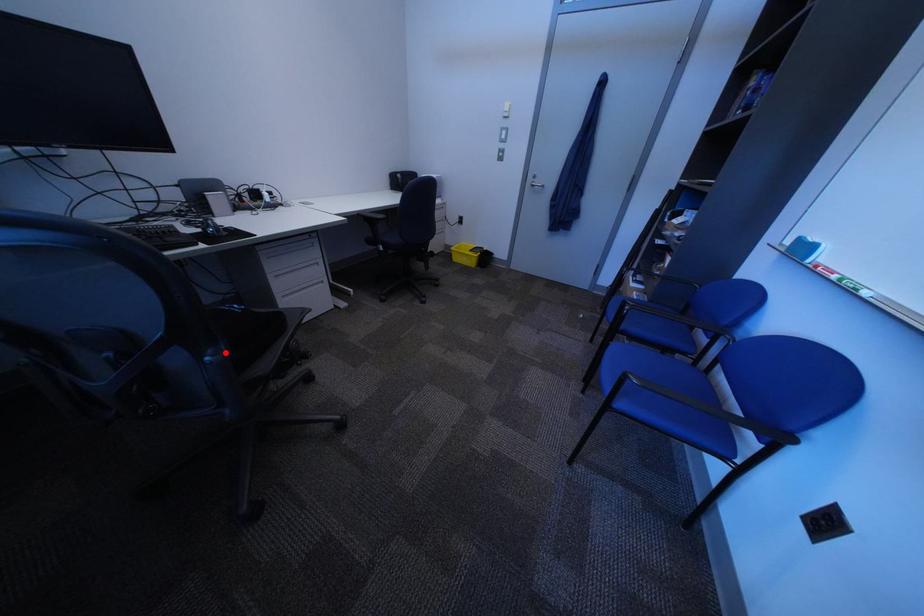
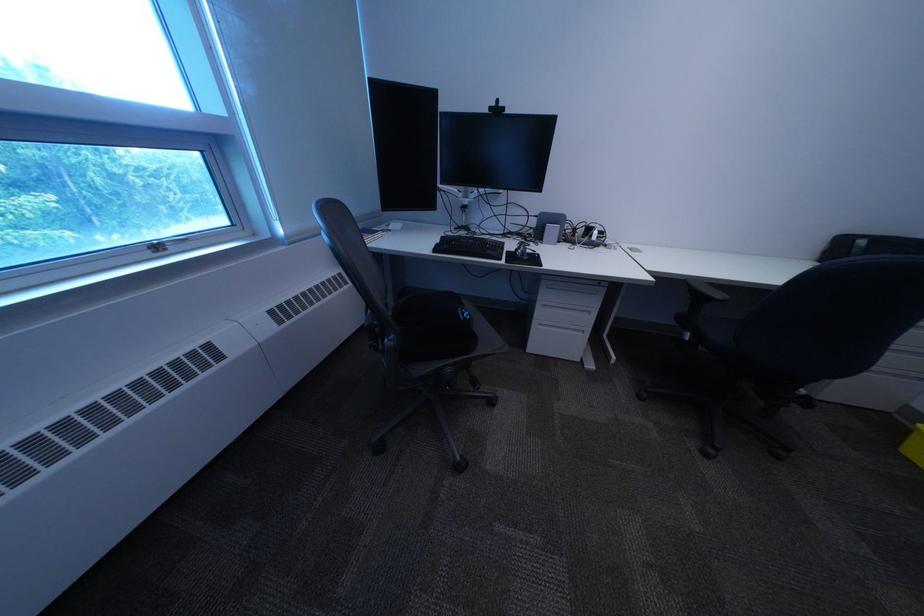
Find the pixel in the second image that matches the highlighted location in the first image.

(407, 338)